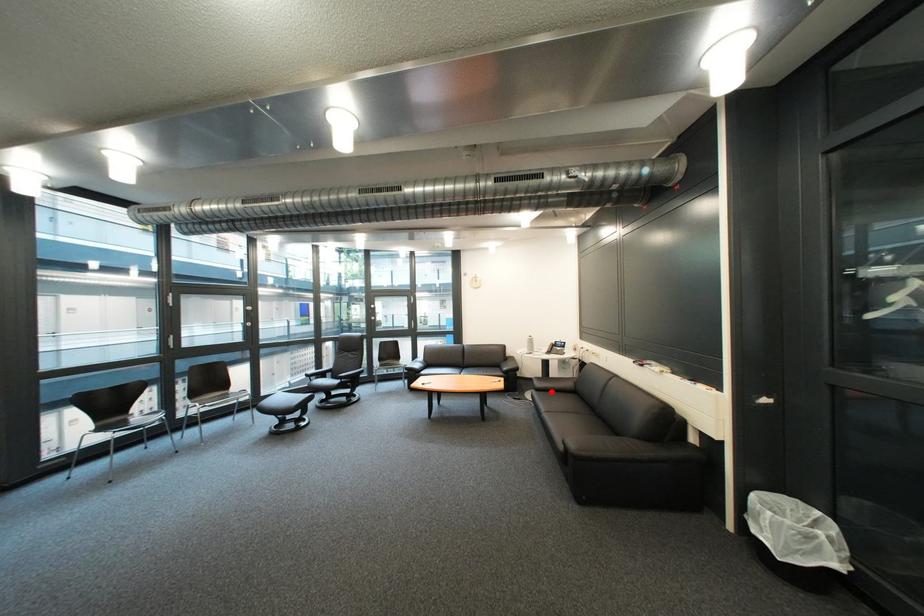
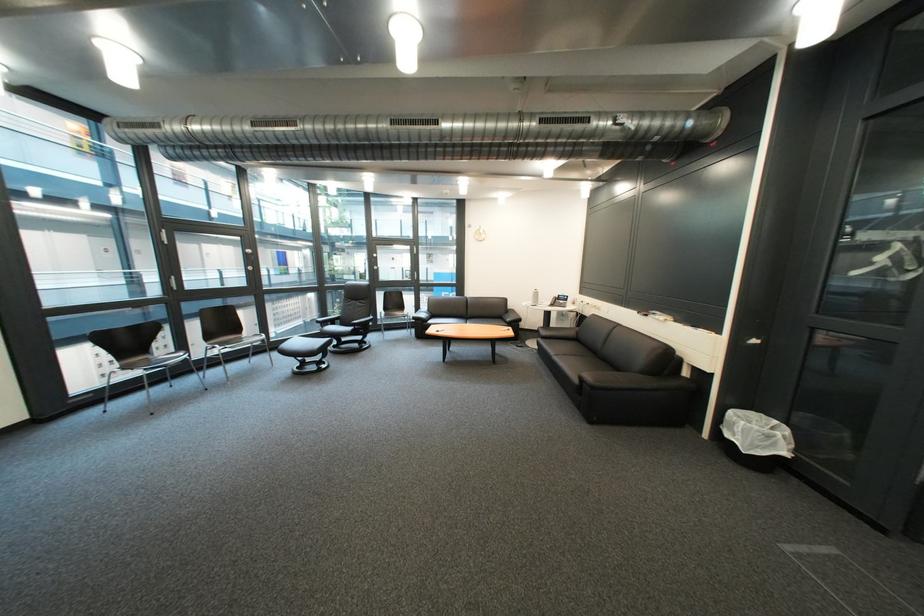
Question: I am providing you with two images of the same scene from different viewpoints. Given a red point in image1, look at the same physical point in image2. Is it:

Choices:
 (A) Closer to the viewpoint
 (B) Farther from the viewpoint

Answer: (A)